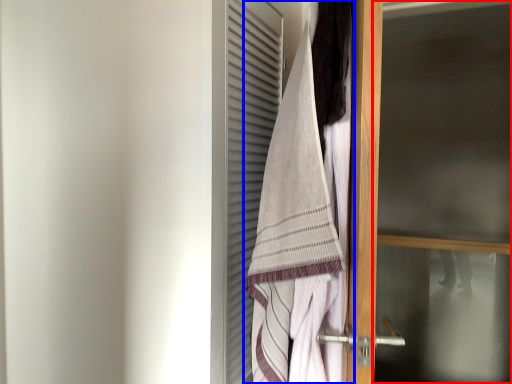
Question: Which object appears closest to the camera in this image, screen door (highlighted by a red box) or towel (highlighted by a blue box)?

Choices:
 (A) screen door
 (B) towel

Answer: (B)